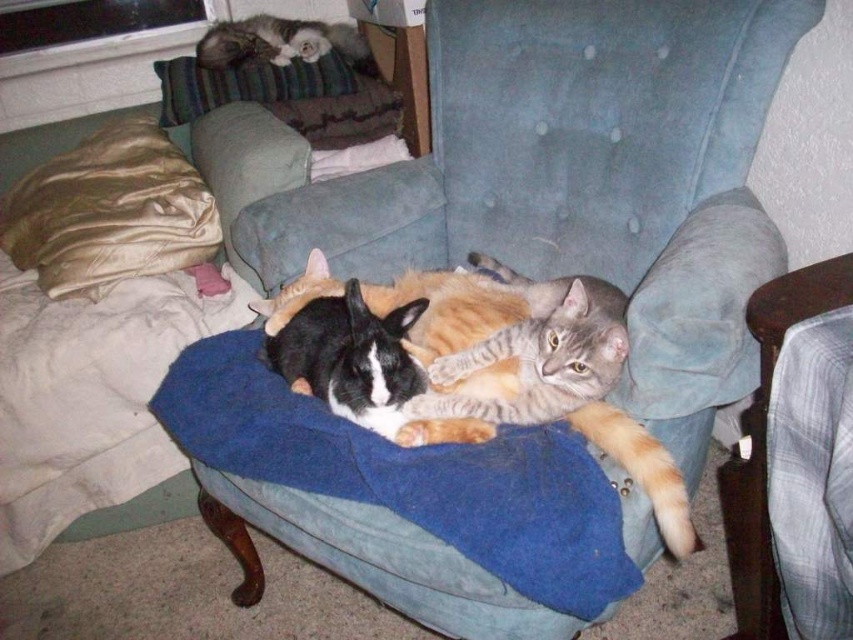
Question: Does blue fabric chair at lower right have a greater width compared to fluffy gray cat at upper left?

Choices:
 (A) yes
 (B) no

Answer: (B)

Question: Which object appears closest to the camera in this image?

Choices:
 (A) blue fleece blanket at center
 (B) blue fabric chair at lower right
 (C) gray striped cat at center

Answer: (B)

Question: Which is nearer to the gray striped cat at center?

Choices:
 (A) blue fleece blanket at center
 (B) fluffy gray cat at upper left
 (C) blue fabric chair at lower right

Answer: (A)

Question: Among these points, which one is nearest to the camera?

Choices:
 (A) (583, 605)
 (B) (508, 397)
 (C) (838, 296)
 (D) (271, 17)

Answer: (C)

Question: Observing the image, what is the correct spatial positioning of gray striped cat at center in reference to fluffy gray cat at upper left?

Choices:
 (A) above
 (B) below

Answer: (B)

Question: Can you confirm if blue fleece blanket at center is positioned above gray striped cat at center?

Choices:
 (A) no
 (B) yes

Answer: (A)